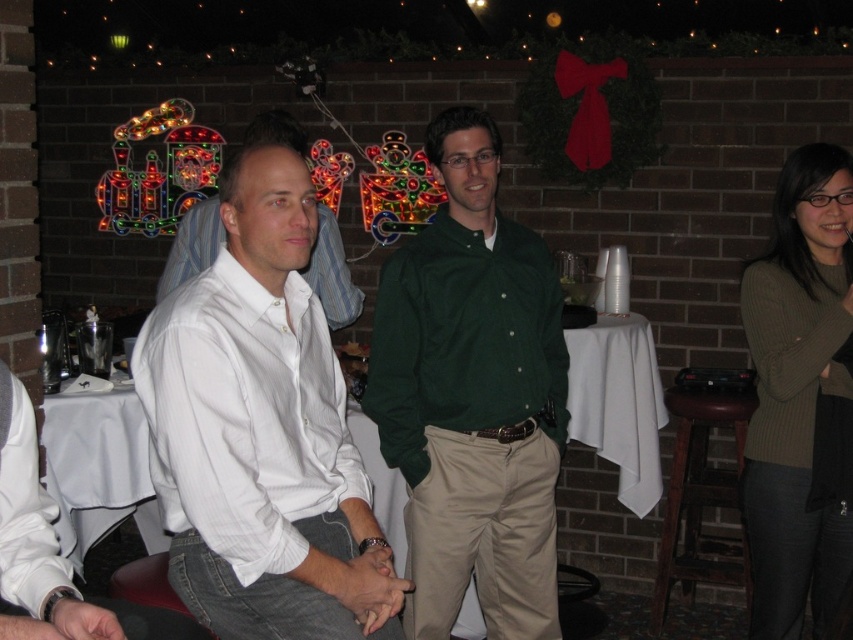
You are standing in the room and want to take a photo of the point at coordinates (233, 298). Is the point within your camera frame if the camera has a focal length of 50mm and the sensor size is 24mm x 36mm?

The point at coordinates (233, 298) is 1.77 meters from the camera. To determine if it is within the camera frame, we need to calculate the field of view. With a 50mm focal length and a 24mm sensor height, the vertical field of view is approximately 27 degrees. However, without knowing the distance from the camera to the subject or the exact positioning of the point relative to the camera axis, it is impossible to definitively confirm if the point is within the frame. The given information only specifies

Consider the image. You are a photographer standing at the center of the room. You want to take a photo of the white cotton shirt at center and the brown wooden stool at lower right. Can you fit both subjects in the frame if your camera has a 1.5 meter field of view?

The white cotton shirt at center is 2.04 meters away from the brown wooden stool at lower right. Since the distance between them exceeds the camera field of view of 1.5 meters, you cannot fit both subjects in the frame.

You are a photographer setting up a camera in the room. You need to place a 1.2 meter wide tripod between the green matte shirt at center and the brown wooden stool at lower right. Is there enough space between them for the tripod?

The green matte shirt at center is wider than the brown wooden stool at lower right. However, the description only provides information about their widths, not the distance between them. Without knowing the actual space between the two objects, it is impossible to determine if the tripod will fit.